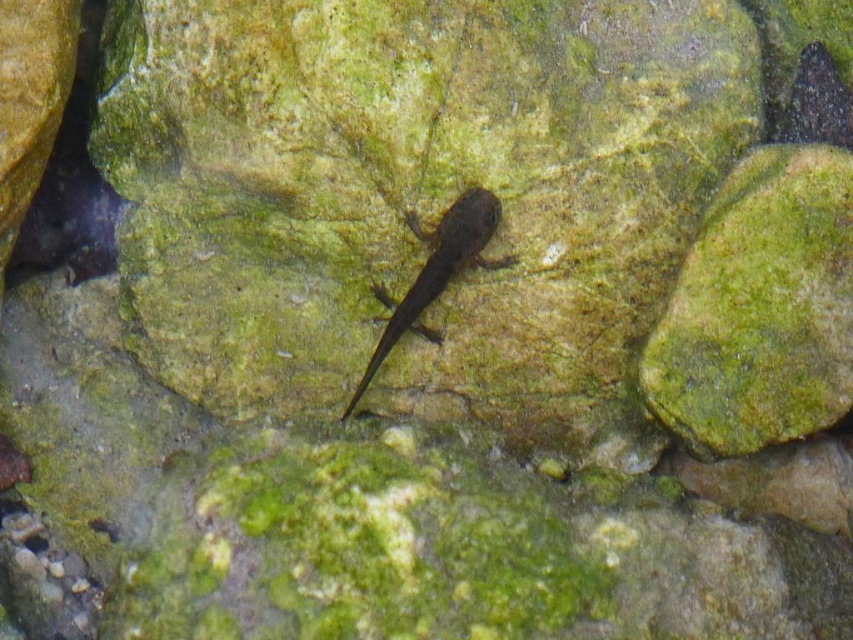
Question: Which object appears farthest from the camera in this image?

Choices:
 (A) shiny black fish at upper right
 (B) dark brown smooth salamander at center

Answer: (B)

Question: Is dark brown smooth salamander at center wider than shiny black fish at upper right?

Choices:
 (A) no
 (B) yes

Answer: (B)

Question: From the image, what is the correct spatial relationship of dark brown smooth salamander at center in relation to shiny black fish at upper right?

Choices:
 (A) right
 (B) left

Answer: (B)

Question: In this image, where is dark brown smooth salamander at center located relative to shiny black fish at upper right?

Choices:
 (A) left
 (B) right

Answer: (A)